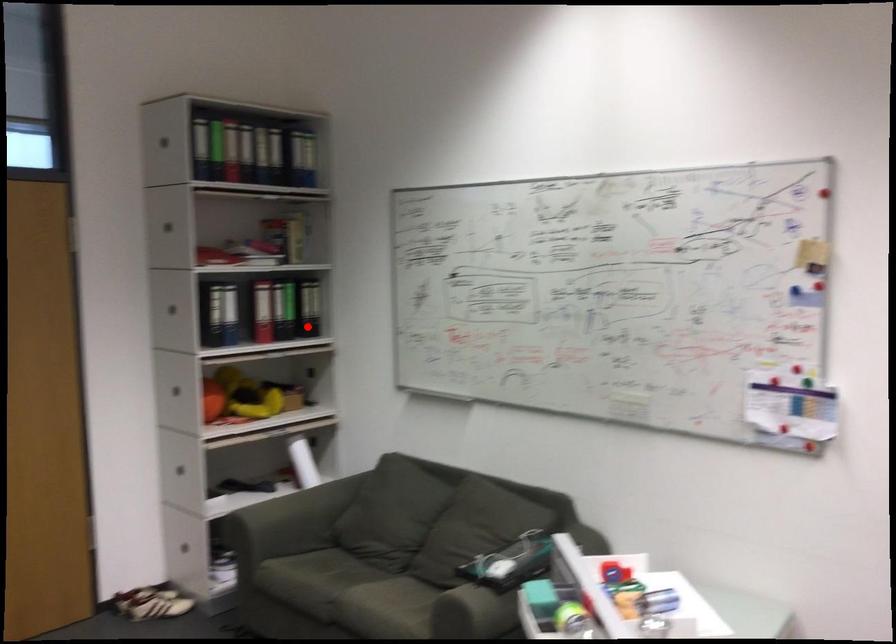
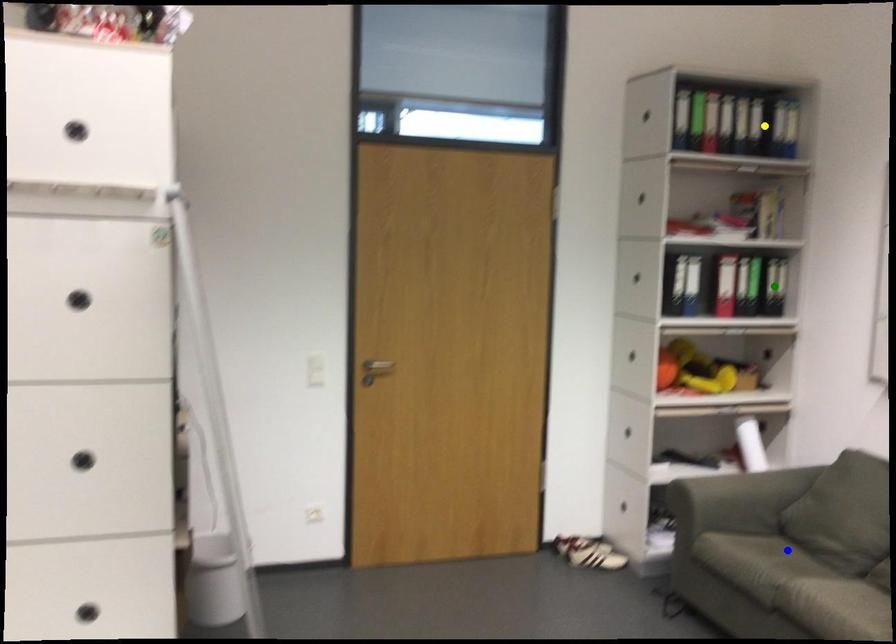
Question: I am providing you with two images of the same scene from different viewpoints. A red point is marked on the first image. You are given multiple points on the second image. Which point in image 2 is actually the same real-world point as the red point in image 1?

Choices:
 (A) green point
 (B) blue point
 (C) yellow point

Answer: (A)